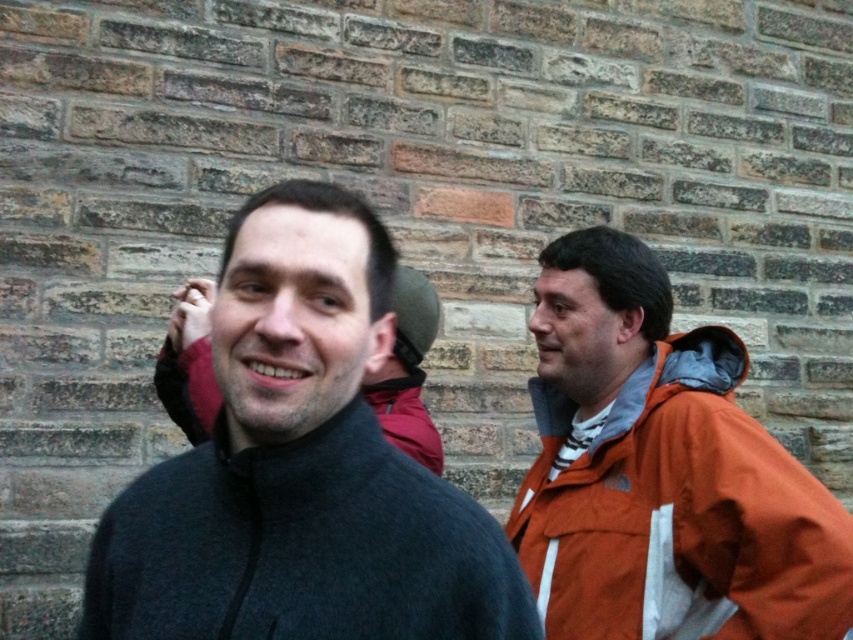
You are a photographer adjusting the focus on your camera. You want to ensure that both the dark gray fleece jacket at center and the orange fabric jacket at right are in focus. Based on their positions, which jacket should you focus on to achieve this?

You should focus on the dark gray fleece jacket at center because it is in front of the orange fabric jacket at right, so focusing on the closer object will ensure both are in focus.

You are a photographer trying to adjust the focus on your camera. The main subject is wearing a dark gray fleece jacket at center. Where should you focus to ensure the jacket is sharp?

You should focus at point (x=300, y=467) to ensure the dark gray fleece jacket at center is sharp.

You are a photographer trying to adjust the lighting for a group photo. You notice the dark gray fleece jacket at center and the orange fabric jacket at right. Which jacket should you focus on to ensure proper exposure, considering their positions in the frame?

The dark gray fleece jacket at center should be focused on for proper exposure since it is positioned above the orange fabric jacket at right, making it the primary subject in the frame.